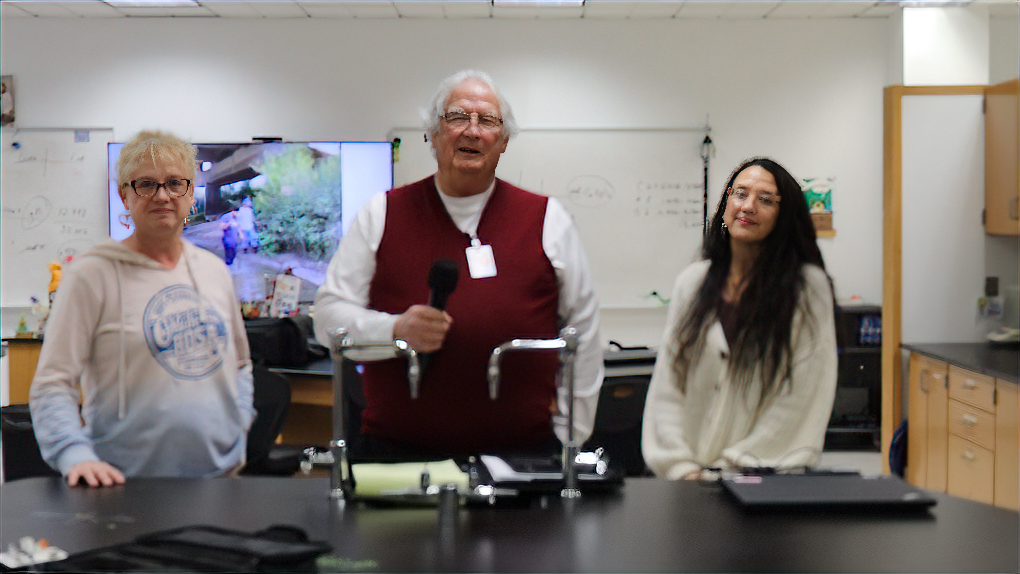
At what (x,y) coordinates should I click in order to perform the action: click on wood cupboards. Please return your answer as a coordinate pair (x, y). The image size is (1020, 574). Looking at the image, I should click on (968, 468), (968, 436), (934, 414).